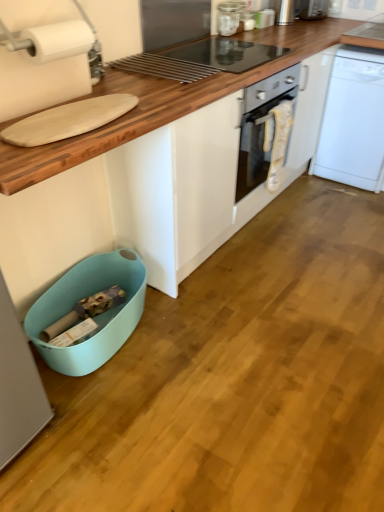
Question: Does satin silver toaster at upper right, which appears as the first appliance when viewed from the right, turn towards teal plastic dish washer at lower left?

Choices:
 (A) no
 (B) yes

Answer: (A)

Question: Can you confirm if satin silver toaster at upper right, positioned as the fifth appliance in left-to-right order, is thinner than teal plastic dish washer at lower left?

Choices:
 (A) no
 (B) yes

Answer: (B)

Question: Is the depth of satin silver toaster at upper right, arranged as the 5th appliance when ordered from the bottom, less than that of teal plastic dish washer at lower left?

Choices:
 (A) no
 (B) yes

Answer: (A)

Question: From the image's perspective, is satin silver toaster at upper right, which is the first appliance from top to bottom, on teal plastic dish washer at lower left?

Choices:
 (A) no
 (B) yes

Answer: (B)

Question: Can you confirm if satin silver toaster at upper right, marked as the 1th appliance in a back-to-front arrangement, is wider than teal plastic dish washer at lower left?

Choices:
 (A) no
 (B) yes

Answer: (A)

Question: Considering the positions of point (33, 53) and point (327, 89), is point (33, 53) closer or farther from the camera than point (327, 89)?

Choices:
 (A) farther
 (B) closer

Answer: (B)

Question: Do you think white matte paper towel at upper left is within white plastic dishwasher at right, or outside of it?

Choices:
 (A) inside
 (B) outside

Answer: (B)

Question: From a real-world perspective, is white matte paper towel at upper left positioned above or below white plastic dishwasher at right?

Choices:
 (A) above
 (B) below

Answer: (A)

Question: From the image's perspective, is white matte paper towel at upper left positioned above or below white plastic dishwasher at right?

Choices:
 (A) below
 (B) above

Answer: (A)

Question: Considering the positions of teal plastic dish washer at lower left and metallic silver toaster at upper right, which ranks as the 2th appliance in top-to-bottom order, in the image, is teal plastic dish washer at lower left wider or thinner than metallic silver toaster at upper right, which ranks as the 2th appliance in top-to-bottom order,?

Choices:
 (A) wide
 (B) thin

Answer: (A)

Question: Looking at the image, does teal plastic dish washer at lower left seem bigger or smaller compared to metallic silver toaster at upper right, which is counted as the fourth appliance, starting from the front?

Choices:
 (A) small
 (B) big

Answer: (B)

Question: Relative to metallic silver toaster at upper right, which is counted as the fourth appliance, starting from the front, is teal plastic dish washer at lower left in front or behind?

Choices:
 (A) front
 (B) behind

Answer: (A)

Question: From a real-world perspective, is teal plastic dish washer at lower left positioned above or below metallic silver toaster at upper right, the fourth appliance when ordered from left to right?

Choices:
 (A) below
 (B) above

Answer: (A)

Question: From the image's perspective, relative to white matte paper towel at upper left, is metallic silver toaster at upper center, the 3th appliance when ordered from left to right, above or below?

Choices:
 (A) above
 (B) below

Answer: (A)

Question: Is point (256, 14) closer or farther from the camera than point (77, 48)?

Choices:
 (A) closer
 (B) farther

Answer: (B)